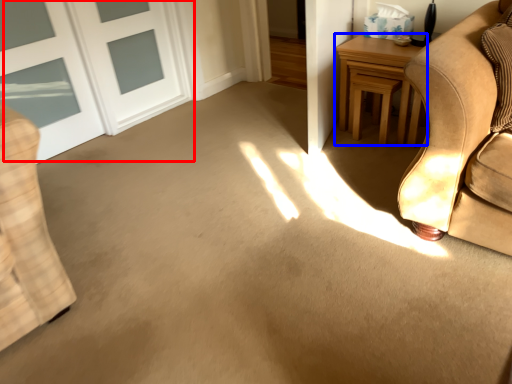
Question: Which point is closer to the camera, door (highlighted by a red box) or table (highlighted by a blue box)?

Choices:
 (A) door
 (B) table

Answer: (A)